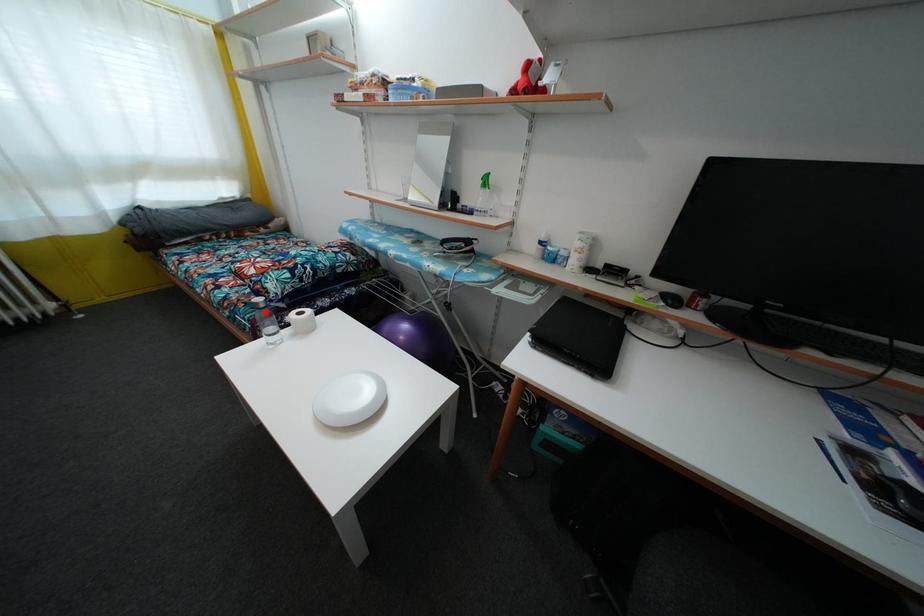
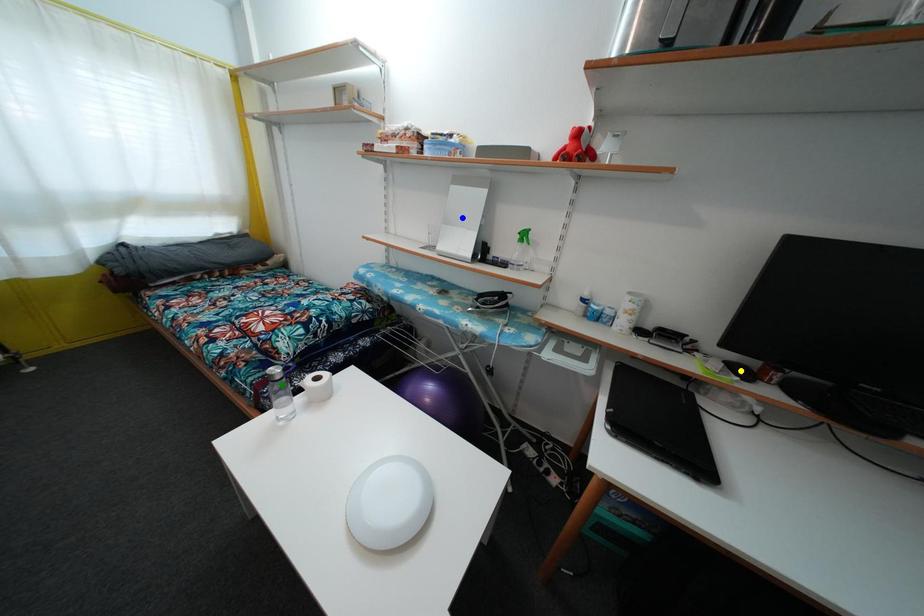
Question: I am providing you with two images of the same scene from different viewpoints. A red point is marked on the first image. You are given multiple points on the second image. Can you choose the point in image 2 that corresponds to the point in image 1?

Choices:
 (A) green point
 (B) blue point
 (C) yellow point

Answer: (A)